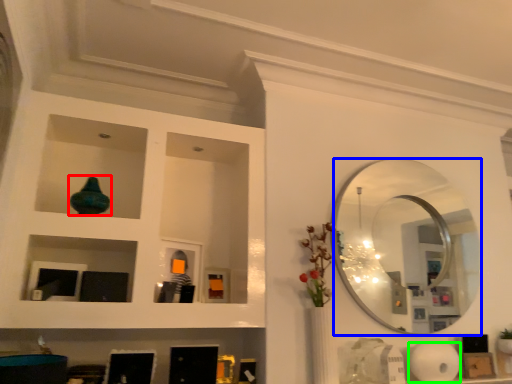
Question: Estimate the real-world distances between objects in this image. Which object is farther from glass vase (highlighted by a red box), mirror (highlighted by a blue box) or paper towel (highlighted by a green box)?

Choices:
 (A) mirror
 (B) paper towel

Answer: (B)